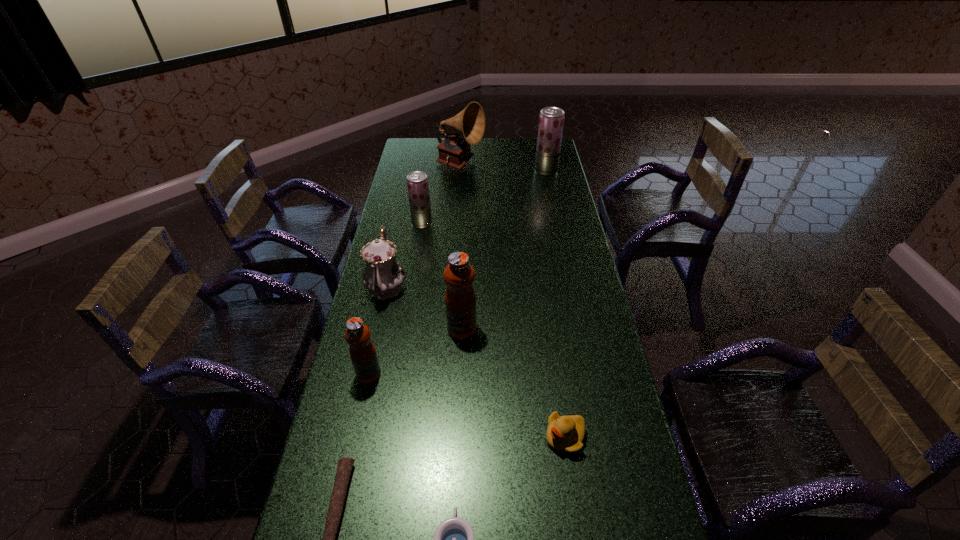
Image resolution: width=960 pixels, height=540 pixels. Identify the location of unoccupied area between the duckling and the second farthest fruit juice. (493, 330).

Where is `free space between the phonograph record and the third farthest object`? free space between the phonograph record and the third farthest object is located at coordinates (442, 194).

The image size is (960, 540). Identify the location of unoccupied area between the second farthest fruit juice and the phonograph record. (442, 194).

Where is `vacant space that is in between the third nearest object and the third farthest object`? vacant space that is in between the third nearest object and the third farthest object is located at coordinates (493, 330).

The height and width of the screenshot is (540, 960). I want to click on empty space that is in between the fifth farthest object and the nearer strawberry fruit juice, so click(x=442, y=276).

Locate which object ranks fourth in proximity to the fourth nearest object. Please provide its 2D coordinates. Your answer should be formatted as a tuple, i.e. [(x, y)], where the tuple contains the x and y coordinates of a point satisfying the conditions above.

[(454, 538)]

Point out which object is positioned as the third nearest to the farther strawberry fruit juice. Please provide its 2D coordinates. Your answer should be formatted as a tuple, i.e. [(x, y)], where the tuple contains the x and y coordinates of a point satisfying the conditions above.

[(383, 276)]

Identify which fruit juice is located as the nearest to the third fruit juice from left to right. Please provide its 2D coordinates. Your answer should be formatted as a tuple, i.e. [(x, y)], where the tuple contains the x and y coordinates of a point satisfying the conditions above.

[(362, 351)]

Select which fruit juice is the third closest to the nearest fruit juice. Please provide its 2D coordinates. Your answer should be formatted as a tuple, i.e. [(x, y)], where the tuple contains the x and y coordinates of a point satisfying the conditions above.

[(551, 120)]

Image resolution: width=960 pixels, height=540 pixels. Identify the location of free space that satisfies the following two spatial constraints: 1. on the back side of the rightmost fruit juice; 2. on the horn of the phonograph record. (545, 165).